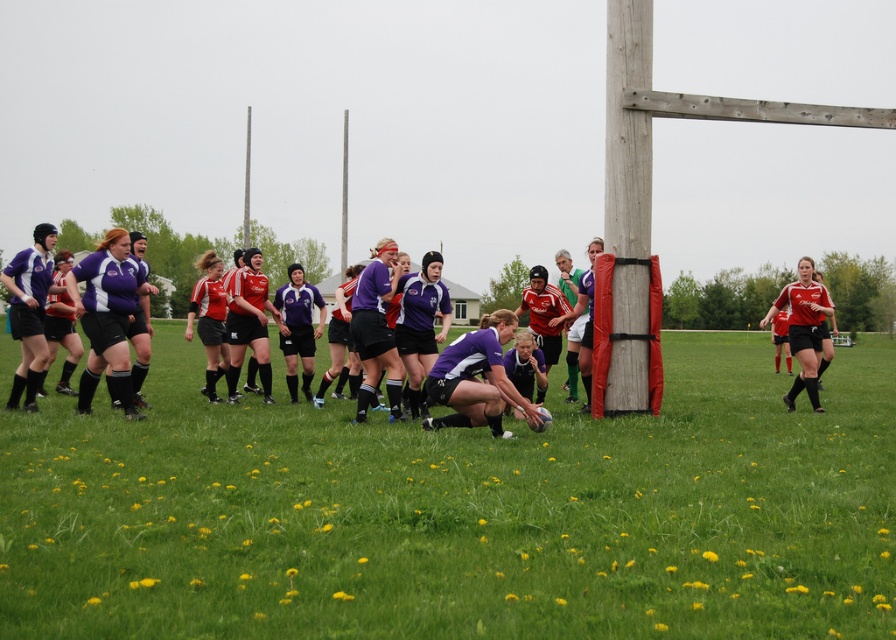
You are a spectator at the rugby match and want to take a photo of the green grass at center and the matte red jersey at right. Based on their positions, which object is located to the left of the other?

The green grass at center is to the left of the matte red jersey at right.

You are a photographer standing at the edge of the rugby field. You want to take a photo of the green grass at center and the purple matte jersey at center. Based on their positions, which object is wider in the image?

The green grass at center is wider than the purple matte jersey at center according to the description.

You are a photographer standing at the edge of the rugby field. You want to take a photo of the two points marked in the image. Which point, point 1 at coordinates (557,545) or point 2 at coordinates (798,301), will appear larger in your photo?

Point 1 at coordinates (557,545) will appear larger in the photo because it is closer to the camera than point 2 at coordinates (798,301).